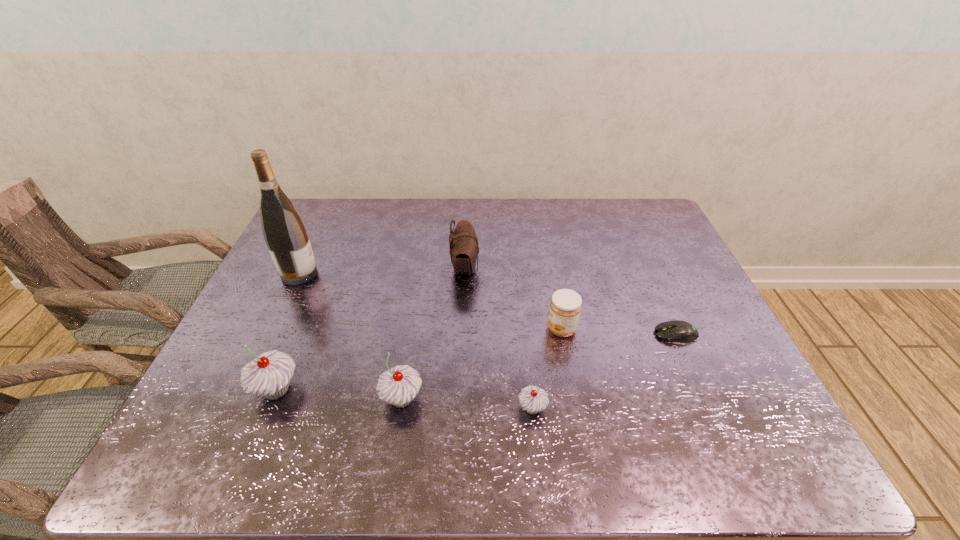
You are a GUI agent. You are given a task and a screenshot of the screen. Output one action in this format:
    pyautogui.click(x=<x>, y=<y>)
    Task: Click on the leftmost cupcake
    
    Given the screenshot: What is the action you would take?
    pyautogui.click(x=269, y=375)

At what (x,y) coordinates should I click in order to perform the action: click on the fifth object from right to left. Please return your answer as a coordinate pair (x, y). Looking at the image, I should click on (398, 386).

This screenshot has width=960, height=540. Identify the location of the second cupcake from right to left. (398, 386).

Where is `the fifth object from left to right`? the fifth object from left to right is located at coordinates (533, 399).

At what (x,y) coordinates should I click in order to perform the action: click on the rightmost cupcake. Please return your answer as a coordinate pair (x, y). The width and height of the screenshot is (960, 540). Looking at the image, I should click on (533, 399).

You are a GUI agent. You are given a task and a screenshot of the screen. Output one action in this format:
    pyautogui.click(x=<x>, y=<y>)
    Task: Click on the pouch
    
    Given the screenshot: What is the action you would take?
    pyautogui.click(x=463, y=244)

You are a GUI agent. You are given a task and a screenshot of the screen. Output one action in this format:
    pyautogui.click(x=<x>, y=<y>)
    Task: Click on the jam
    The image size is (960, 540).
    Given the screenshot: What is the action you would take?
    pyautogui.click(x=565, y=306)

In order to click on wine bottle in this screenshot , I will do `click(284, 231)`.

Image resolution: width=960 pixels, height=540 pixels. Find the location of `the shortest object`. the shortest object is located at coordinates (678, 331).

Find the location of `computer mouse`. computer mouse is located at coordinates (678, 331).